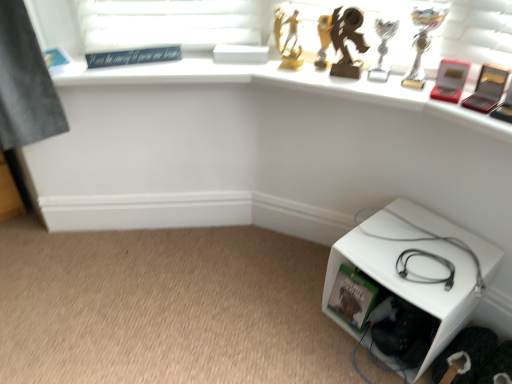
Measure the distance between point [421,240] and camera.

Point [421,240] and camera are 4.01 feet apart from each other.

At what (x,y) coordinates should I click in order to perform the action: click on gray matte cable at lower right. Please return your answer as a coordinate pair (x, y). This screenshot has height=384, width=512. Looking at the image, I should click on (428, 240).

Image resolution: width=512 pixels, height=384 pixels. Describe the element at coordinates (428, 240) in the screenshot. I see `gray matte cable at lower right` at that location.

What is the approximate height of gray matte cable at lower right?

2.48 inches.

Measure the distance between white plastic cube at lower right and camera.

white plastic cube at lower right and camera are 3.28 feet apart from each other.

This screenshot has height=384, width=512. What are the coordinates of `white plastic cube at lower right` in the screenshot? It's located at (404, 279).

This screenshot has width=512, height=384. Describe the element at coordinates (404, 279) in the screenshot. I see `white plastic cube at lower right` at that location.

At what (x,y) coordinates should I click in order to perform the action: click on gray matte cable at lower right. Please return your answer as a coordinate pair (x, y). Looking at the image, I should click on (428, 240).

Does white plastic cube at lower right appear on the right side of gray matte cable at lower right?

Correct, you'll find white plastic cube at lower right to the right of gray matte cable at lower right.

Looking at this image, relative to gray matte cable at lower right, is white plastic cube at lower right in front or behind?

Visually, white plastic cube at lower right is located in front of gray matte cable at lower right.

Between point (370, 217) and point (424, 240), which one is positioned in front?

Positioned in front is point (424, 240).

Based on the photo, from the image's perspective, between white plastic cube at lower right and gray matte cable at lower right, who is located below?

white plastic cube at lower right is shown below in the image.

From a real-world perspective, who is located lower, white plastic cube at lower right or gray matte cable at lower right?

white plastic cube at lower right.

Considering the relative sizes of white plastic cube at lower right and gray matte cable at lower right in the image provided, is white plastic cube at lower right wider than gray matte cable at lower right?

Yes, white plastic cube at lower right is wider than gray matte cable at lower right.

Can you confirm if white plastic cube at lower right is shorter than gray matte cable at lower right?

Incorrect, the height of white plastic cube at lower right does not fall short of that of gray matte cable at lower right.

Which of these two, white plastic cube at lower right or gray matte cable at lower right, is smaller?

Smaller between the two is gray matte cable at lower right.

Is white plastic cube at lower right outside of gray matte cable at lower right?

Absolutely, white plastic cube at lower right is external to gray matte cable at lower right.

Can you see white plastic cube at lower right touching gray matte cable at lower right?

Yes, white plastic cube at lower right is in contact with gray matte cable at lower right.

Is white plastic cube at lower right facing towards gray matte cable at lower right?

No, white plastic cube at lower right does not turn towards gray matte cable at lower right.

How different are the orientations of white plastic cube at lower right and gray matte cable at lower right in degrees?

There is a 20.1-degree angle between the facing directions of white plastic cube at lower right and gray matte cable at lower right.

From the picture: Measure the distance from white plastic cube at lower right to gray matte cable at lower right.

white plastic cube at lower right and gray matte cable at lower right are 2.58 inches apart from each other.

The width and height of the screenshot is (512, 384). I want to click on cable to the left of white plastic cube at lower right, so click(x=428, y=240).

Is gray matte cable at lower right at the left side of white plastic cube at lower right?

Correct, you'll find gray matte cable at lower right to the left of white plastic cube at lower right.

Which object is closer to the camera, gray matte cable at lower right or white plastic cube at lower right?

white plastic cube at lower right is closer to the camera.

Between point (390, 239) and point (451, 254), which one is positioned behind?

The point (390, 239) is behind.

From the image's perspective, is gray matte cable at lower right positioned above or below white plastic cube at lower right?

gray matte cable at lower right is above white plastic cube at lower right.

From a real-world perspective, is gray matte cable at lower right on top of white plastic cube at lower right?

Yes, from a real-world perspective, gray matte cable at lower right is on top of white plastic cube at lower right.

Can you confirm if gray matte cable at lower right is thinner than white plastic cube at lower right?

Correct, the width of gray matte cable at lower right is less than that of white plastic cube at lower right.

Considering the sizes of gray matte cable at lower right and white plastic cube at lower right in the image, is gray matte cable at lower right taller or shorter than white plastic cube at lower right?

Considering their sizes, gray matte cable at lower right has less height than white plastic cube at lower right.

Considering the sizes of objects gray matte cable at lower right and white plastic cube at lower right in the image provided, who is smaller, gray matte cable at lower right or white plastic cube at lower right?

With smaller size is gray matte cable at lower right.

Could white plastic cube at lower right be considered to be inside gray matte cable at lower right?

Definitely not — white plastic cube at lower right is not inside gray matte cable at lower right.

Is gray matte cable at lower right beside white plastic cube at lower right?

Yes, gray matte cable at lower right is next to white plastic cube at lower right.

Is gray matte cable at lower right turned away from white plastic cube at lower right?

gray matte cable at lower right does not have its back to white plastic cube at lower right.

Locate an element on the screen. cable to the left of white plastic cube at lower right is located at coordinates (428, 240).

Where is `cable that is on the left side of white plastic cube at lower right`? The height and width of the screenshot is (384, 512). cable that is on the left side of white plastic cube at lower right is located at coordinates (428, 240).

At what (x,y) coordinates should I click in order to perform the action: click on furniture directly beneath the gray matte cable at lower right (from a real-world perspective). Please return your answer as a coordinate pair (x, y). The height and width of the screenshot is (384, 512). Looking at the image, I should click on (404, 279).